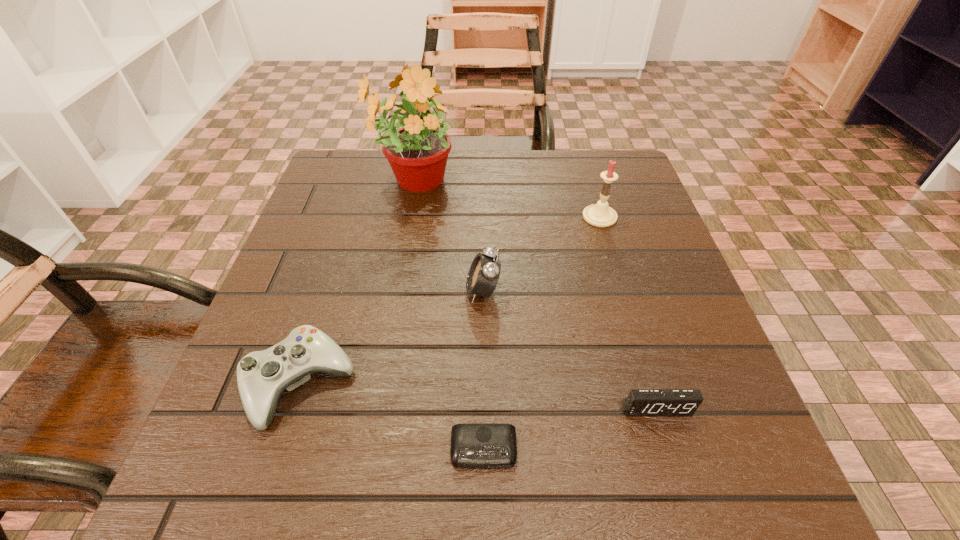
I want to click on vacant space located 0.190m on the left of the second tallest object, so click(x=497, y=217).

Identify the location of vacant space located 0.140m on the face of the tallest alarm clock. The width and height of the screenshot is (960, 540). (392, 291).

Where is `vacant point located on the face of the tallest alarm clock`? vacant point located on the face of the tallest alarm clock is located at coordinates (402, 291).

In order to click on free space located on the face of the tallest alarm clock in this screenshot , I will do 306,291.

The image size is (960, 540). I want to click on free space located 0.310m on the right of the control, so click(x=552, y=384).

Identify the location of vacant space located on the front-facing side of the second nearest alarm clock. Image resolution: width=960 pixels, height=540 pixels. pyautogui.click(x=676, y=472).

In order to click on object at the far edge in this screenshot , I will do `click(417, 152)`.

You are a GUI agent. You are given a task and a screenshot of the screen. Output one action in this format:
    pyautogui.click(x=<x>, y=<y>)
    Task: Click on the object positioned at the near edge
    The image size is (960, 540).
    Given the screenshot: What is the action you would take?
    pyautogui.click(x=473, y=445)

The image size is (960, 540). In order to click on flowerpot that is at the left edge in this screenshot , I will do `click(417, 152)`.

In order to click on control situated at the left edge in this screenshot , I will do `click(262, 376)`.